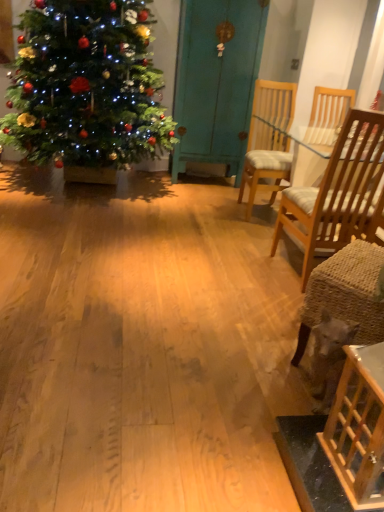
You are a GUI agent. You are given a task and a screenshot of the screen. Output one action in this format:
    pyautogui.click(x=<x>, y=<y>)
    Task: Click on the free point in front of wooden chair with cushion at center, positioned as the first chair in back-to-front order
    
    Given the screenshot: What is the action you would take?
    pyautogui.click(x=246, y=231)